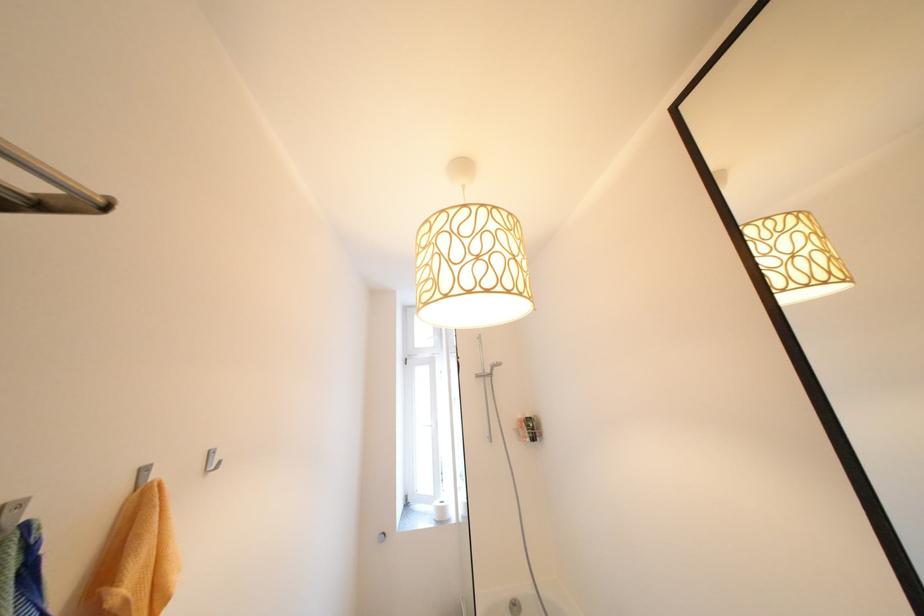
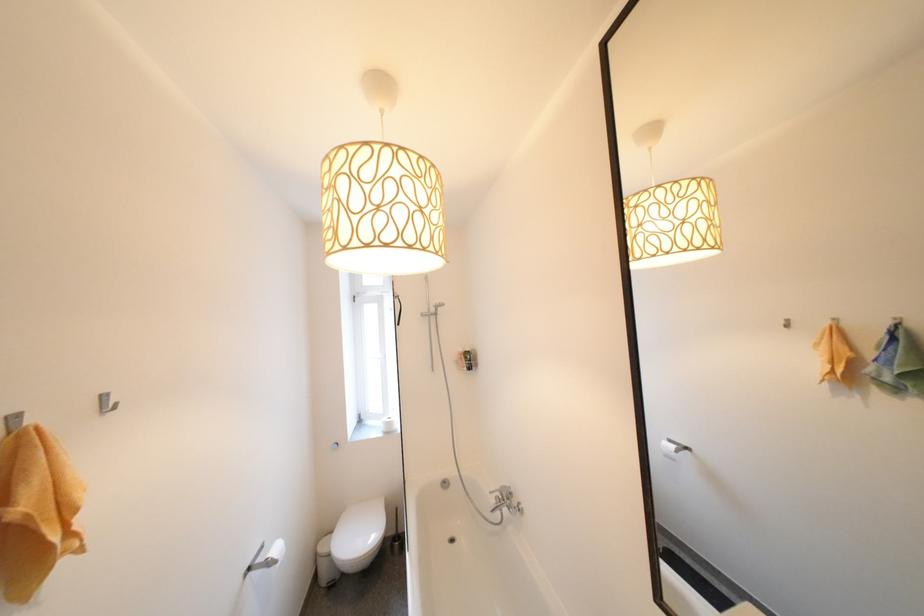
The point at (x=490, y=371) is marked in the first image. Where is the corresponding point in the second image?

(434, 312)